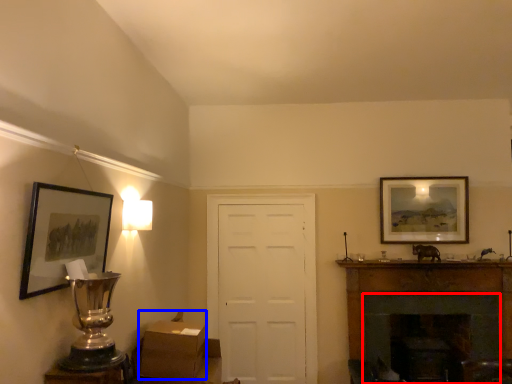
Question: Which of the following is the closest to the observer, fireplace (highlighted by a red box) or cardboard box (highlighted by a blue box)?

Choices:
 (A) fireplace
 (B) cardboard box

Answer: (B)